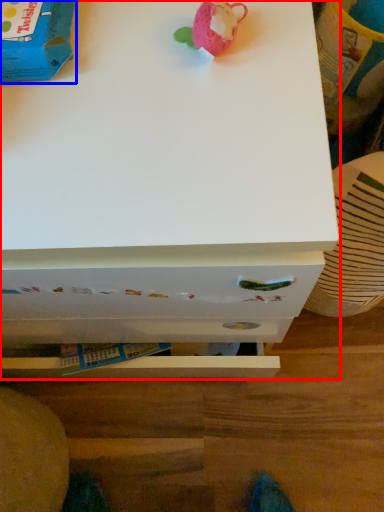
Question: Among these objects, which one is farthest to the camera, chest of drawers (highlighted by a red box) or toy (highlighted by a blue box)?

Choices:
 (A) chest of drawers
 (B) toy

Answer: (B)